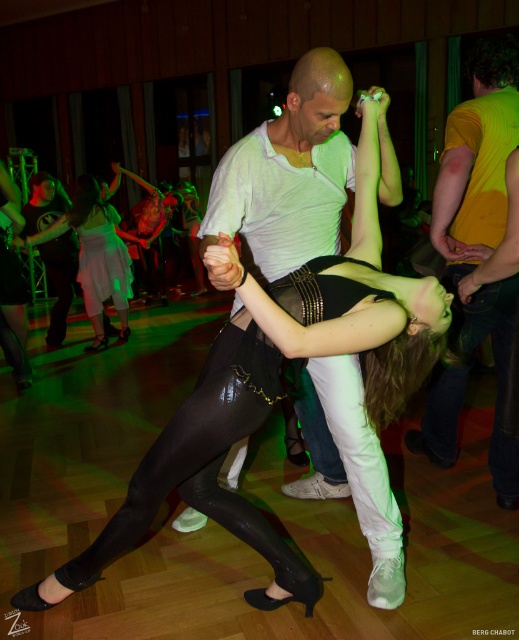
Based on the photo, you are a photographer at the event and want to capture a photo of both the matte black tights at center and the yellow matte shirt at upper right. Which object will appear larger in the photo?

The matte black tights at center will appear larger in the photo because it is closer to the viewer than the yellow matte shirt at upper right.

You are a photographer at the dance event and want to capture the matte black tights at center in your photo. The camera is positioned at the point with coordinates point (277, 376). Will the camera be focused on the matte black tights at center?

Yes, the camera positioned at point (277, 376) is focused on the matte black tights at center because the coordinates correspond to that object.